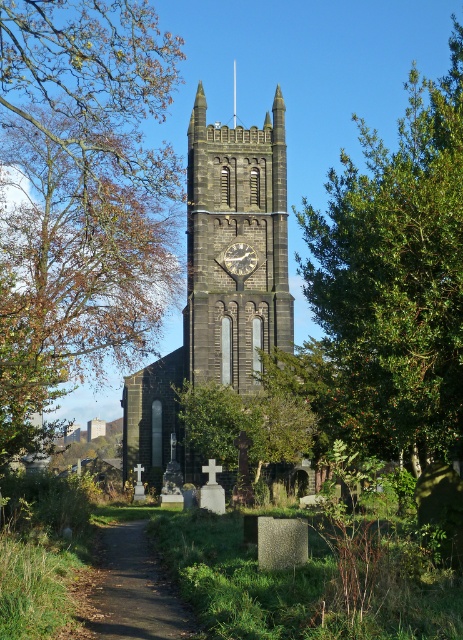
Can you confirm if dark gray stone clock tower at center is positioned to the right of silver metallic clock at center?

In fact, dark gray stone clock tower at center is to the left of silver metallic clock at center.

The width and height of the screenshot is (463, 640). Describe the element at coordinates (233, 243) in the screenshot. I see `dark gray stone clock tower at center` at that location.

Describe the element at coordinates (233, 243) in the screenshot. I see `dark gray stone clock tower at center` at that location.

This screenshot has width=463, height=640. What are the coordinates of `dark gray stone clock tower at center` in the screenshot? It's located at (233, 243).

Which is more to the left, dark gray stone church tower at center or brown dirt path at lower left?

From the viewer's perspective, brown dirt path at lower left appears more on the left side.

Describe the element at coordinates (219, 280) in the screenshot. The height and width of the screenshot is (640, 463). I see `dark gray stone church tower at center` at that location.

Locate an element on the screen. The width and height of the screenshot is (463, 640). dark gray stone church tower at center is located at coordinates (219, 280).

Between brown dirt path at lower left and silver metallic clock at center, which one has less height?

silver metallic clock at center is shorter.

Does point (193, 628) come farther from viewer compared to point (245, 252)?

That is False.

The width and height of the screenshot is (463, 640). I want to click on brown dirt path at lower left, so click(x=132, y=589).